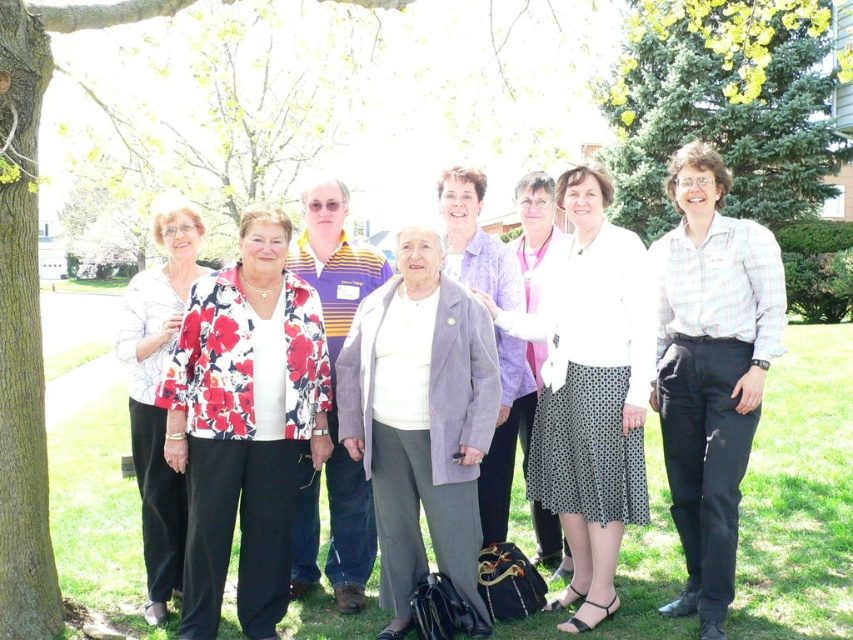
You are a photographer trying to capture a group photo of the floral fabric jacket at center and the light purple fabric jacket at center. Since you want to ensure both jackets are clearly visible, which jacket should you focus on first to account for their sizes?

The floral fabric jacket at center has a larger width than the light purple fabric jacket at center, so you should focus on the floral fabric jacket at center first to ensure it is clearly visible.

You are a photographer trying to capture a photo of the light purple fabric jacket at center without including the green evergreen tree at upper right in the frame. Based on their positions, is this possible?

The green evergreen tree at upper right is positioned over the light purple fabric jacket at center, so it would block the view of the jacket. Therefore, it is not possible to capture the jacket without the tree in the frame.